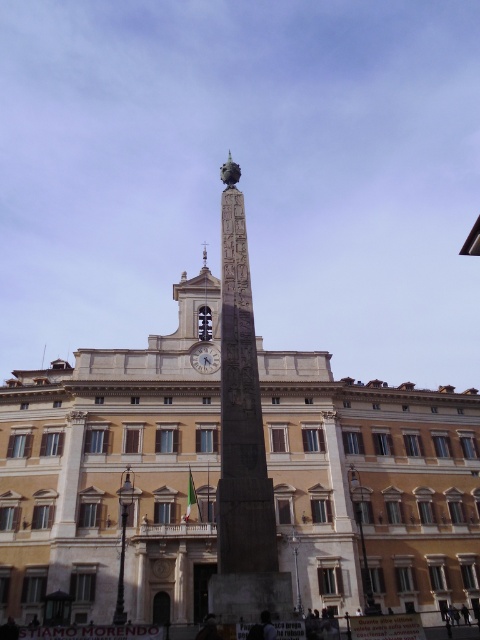
In the scene shown: Between granite obelisk at center and matte silver clock at center, which one is positioned higher?

matte silver clock at center is higher up.

Does granite obelisk at center have a larger size compared to matte silver clock at center?

Yes, granite obelisk at center is bigger than matte silver clock at center.

Does point (238, 506) lie behind point (218, 360)?

No, (238, 506) is closer to viewer.

At what (x,y) coordinates should I click in order to perform the action: click on granite obelisk at center. Please return your answer as a coordinate pair (x, y). The height and width of the screenshot is (640, 480). Looking at the image, I should click on (242, 444).